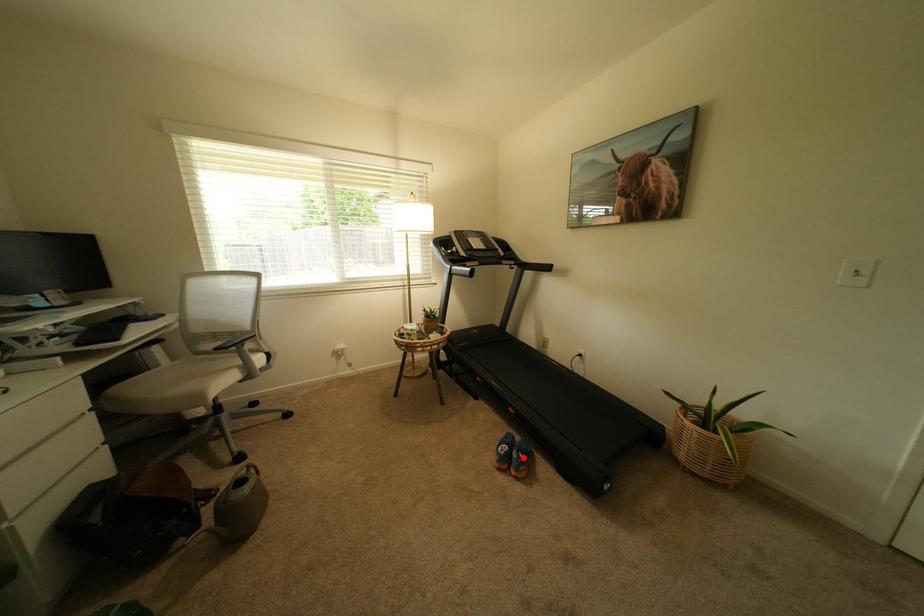
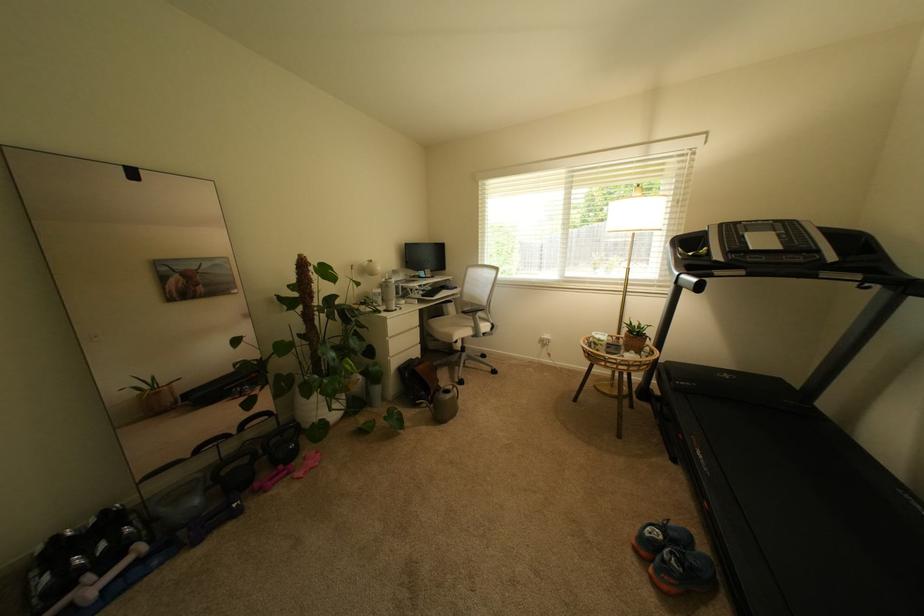
The point at the highlighted location is marked in the first image. Where is the corresponding point in the second image?

(674, 557)